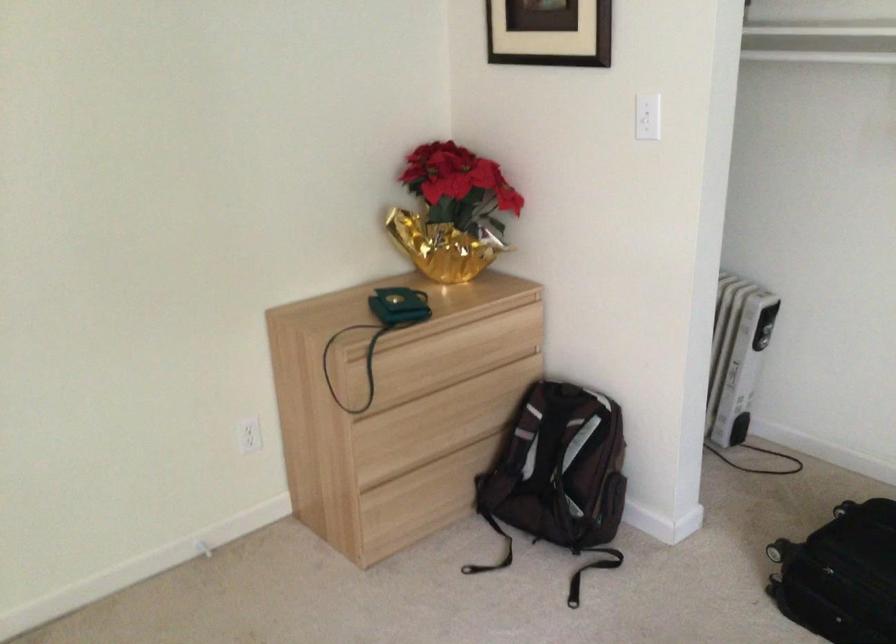
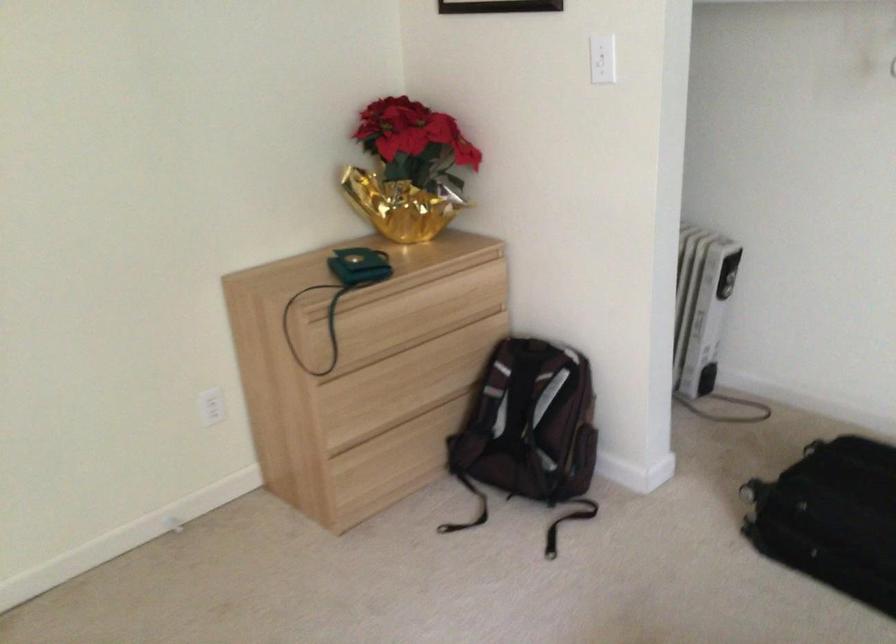
Question: The camera is either moving clockwise (left) or counter-clockwise (right) around the object. The first image is from the beginning of the video and the second image is from the end. Is the camera moving left or right when shooting the video?

Choices:
 (A) Left
 (B) Right

Answer: (A)